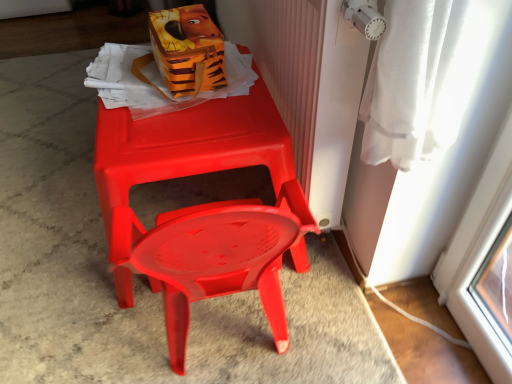
Question: Is white textured radiator at upper right wider than orange fabric lunch box at upper center?

Choices:
 (A) no
 (B) yes

Answer: (A)

Question: From the image's perspective, would you say white textured radiator at upper right is shown under orange fabric lunch box at upper center?

Choices:
 (A) no
 (B) yes

Answer: (A)

Question: From a real-world perspective, does white textured radiator at upper right sit lower than orange fabric lunch box at upper center?

Choices:
 (A) no
 (B) yes

Answer: (B)

Question: Is orange fabric lunch box at upper center at the back of white textured radiator at upper right?

Choices:
 (A) yes
 (B) no

Answer: (A)

Question: From the image's perspective, is white textured radiator at upper right on orange fabric lunch box at upper center?

Choices:
 (A) no
 (B) yes

Answer: (B)

Question: Is white textured radiator at upper right not near orange fabric lunch box at upper center?

Choices:
 (A) no
 (B) yes

Answer: (A)

Question: Is white textured radiator at upper right not near matte plastic chair at center?

Choices:
 (A) yes
 (B) no

Answer: (B)

Question: Can you confirm if white textured radiator at upper right is bigger than matte plastic chair at center?

Choices:
 (A) no
 (B) yes

Answer: (A)

Question: Can you confirm if white textured radiator at upper right is wider than matte plastic chair at center?

Choices:
 (A) yes
 (B) no

Answer: (B)

Question: Is white textured radiator at upper right facing away from matte plastic chair at center?

Choices:
 (A) yes
 (B) no

Answer: (B)

Question: Is white textured radiator at upper right thinner than matte plastic chair at center?

Choices:
 (A) yes
 (B) no

Answer: (A)

Question: Is white textured radiator at upper right beside matte plastic chair at center?

Choices:
 (A) yes
 (B) no

Answer: (B)

Question: Can you confirm if matte plastic chair at center is taller than white textured radiator at upper right?

Choices:
 (A) yes
 (B) no

Answer: (B)